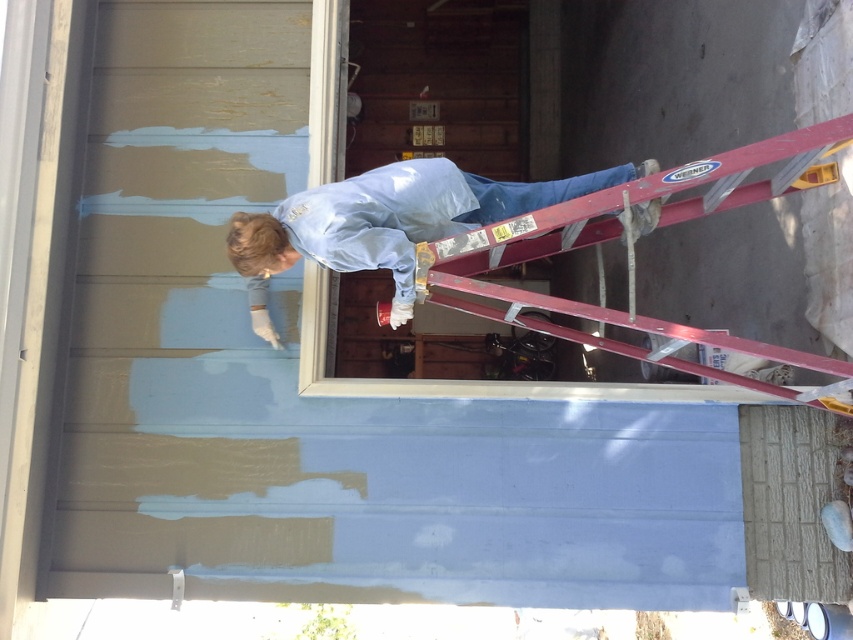
Does metallic red ladder at upper right lie behind light blue fabric at upper center?

No, it is in front of light blue fabric at upper center.

Does metallic red ladder at upper right come in front of light blue fabric at upper center?

Yes, metallic red ladder at upper right is in front of light blue fabric at upper center.

Who is more distant from viewer, (804, 164) or (347, 180)?

Positioned behind is point (347, 180).

I want to click on metallic red ladder at upper right, so click(659, 225).